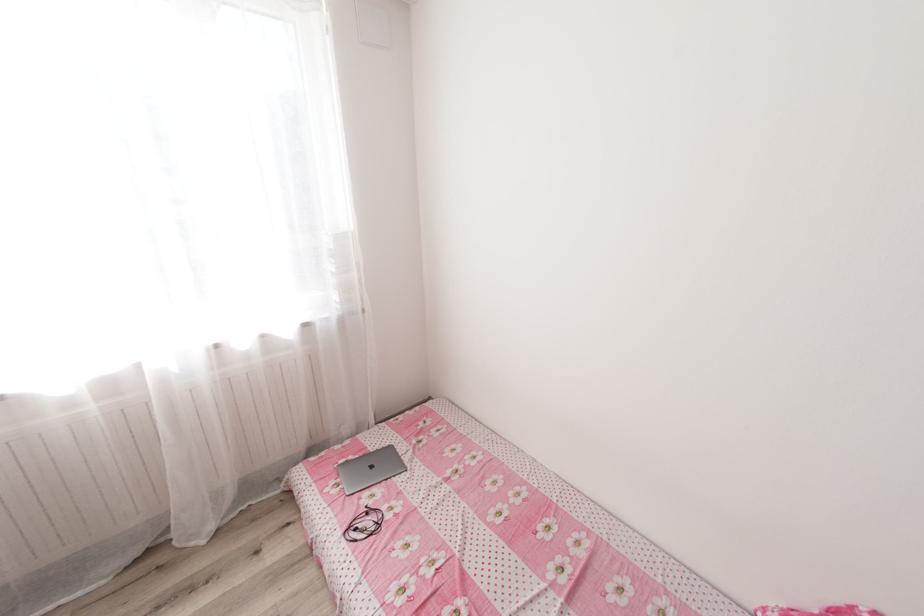
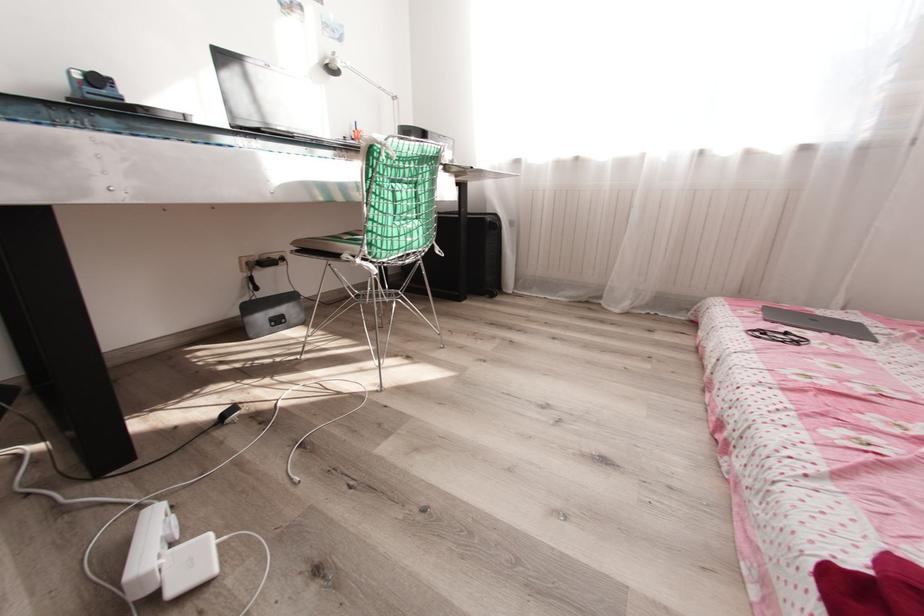
Question: The camera is either moving clockwise (left) or counter-clockwise (right) around the object. The first image is from the beginning of the video and the second image is from the end. Is the camera moving left or right when shooting the video?

Choices:
 (A) Left
 (B) Right

Answer: (B)